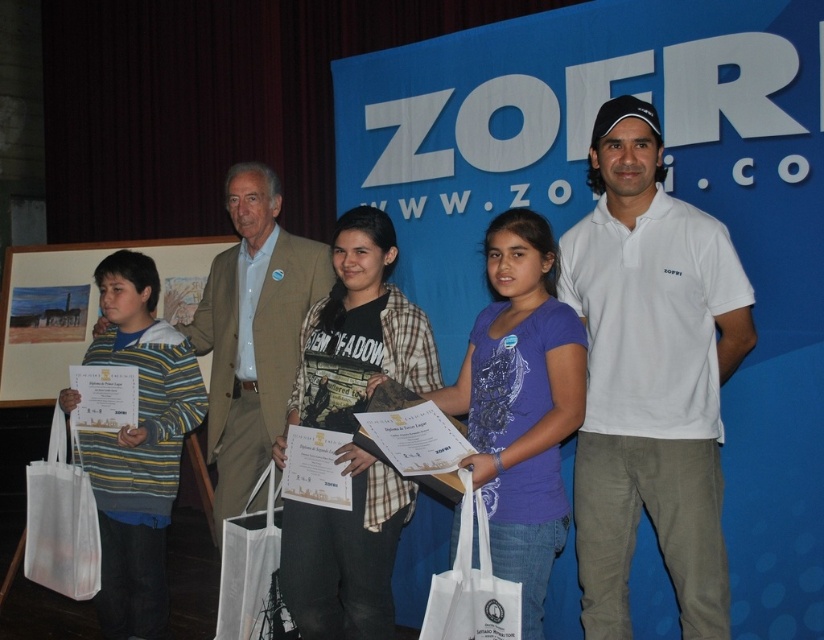
Question: Can you confirm if white fabric bag at lower left is positioned above white mesh bag at lower center?

Choices:
 (A) no
 (B) yes

Answer: (B)

Question: Considering the real-world distances, which object is farthest from the wooden framed picture at left?

Choices:
 (A) white cotton polo shirt at center
 (B) striped cotton shirt at left

Answer: (A)

Question: Which point is closer to the camera taking this photo?

Choices:
 (A) (148, 531)
 (B) (166, 260)
 (C) (461, 595)
 (D) (218, 596)

Answer: (C)

Question: Which object is positioned farthest from the striped cotton shirt at left?

Choices:
 (A) matte white shirt at center
 (B) white fabric bag at lower center
 (C) white cotton polo shirt at center
 (D) white fabric bag at lower left

Answer: (A)

Question: From the image, what is the correct spatial relationship of wooden framed picture at left in relation to white fabric bag at lower center?

Choices:
 (A) above
 (B) below

Answer: (A)

Question: Does striped cotton shirt at left come in front of wooden framed picture at left?

Choices:
 (A) yes
 (B) no

Answer: (A)